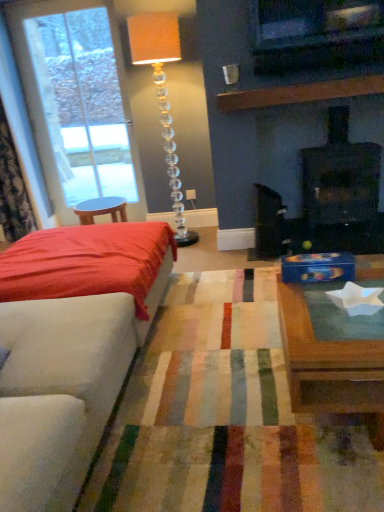
Question: Does clear glass door at left come behind satin red bed at left?

Choices:
 (A) no
 (B) yes

Answer: (B)

Question: Can we say clear glass door at left lies outside satin red bed at left?

Choices:
 (A) no
 (B) yes

Answer: (B)

Question: From the image's perspective, is clear glass door at left located beneath satin red bed at left?

Choices:
 (A) no
 (B) yes

Answer: (A)

Question: Can you confirm if clear glass door at left is thinner than satin red bed at left?

Choices:
 (A) yes
 (B) no

Answer: (A)

Question: From the image's perspective, is clear glass door at left on top of satin red bed at left?

Choices:
 (A) no
 (B) yes

Answer: (B)

Question: Can you confirm if clear glass door at left is taller than satin red bed at left?

Choices:
 (A) no
 (B) yes

Answer: (B)

Question: Are satin red bed at left and wooden coffee table at center making contact?

Choices:
 (A) yes
 (B) no

Answer: (B)

Question: From the image's perspective, is satin red bed at left under wooden coffee table at center?

Choices:
 (A) no
 (B) yes

Answer: (A)

Question: Is the depth of satin red bed at left greater than that of wooden coffee table at center?

Choices:
 (A) no
 (B) yes

Answer: (B)

Question: Is satin red bed at left facing away from wooden coffee table at center?

Choices:
 (A) no
 (B) yes

Answer: (A)

Question: Is satin red bed at left not inside wooden coffee table at center?

Choices:
 (A) no
 (B) yes

Answer: (B)

Question: Is satin red bed at left shorter than wooden coffee table at center?

Choices:
 (A) no
 (B) yes

Answer: (A)

Question: Can you confirm if translucent crystal floor lamp at center is shorter than satin red bed at left?

Choices:
 (A) yes
 (B) no

Answer: (B)